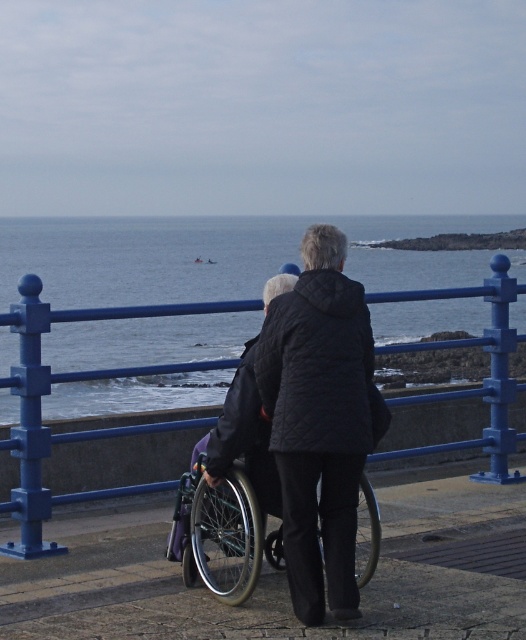
You are a photographer positioned at the edge of the promenade. You want to take a photo that includes both the black quilted jacket at center and the silver metallic wheelchair at center. Which object should you focus on first to ensure both are in sharp focus?

The black quilted jacket at center is closer to the viewer than the silver metallic wheelchair at center. To ensure both are in sharp focus, you should focus on the black quilted jacket at center first, as it is closer, and the depth of field will naturally include the farther object.

You are a visitor at the coast and want to take a photo of the blue water at center and the black quilted jacket at center. Which object should you focus on first if you want both to be in clear focus?

The blue water at center is further to the viewer than the black quilted jacket at center, so you should focus on the black quilted jacket at center first to ensure both are in clear focus.

Based on the scene description, where is the blue water at center located in terms of coordinates?

The blue water at center is located at coordinates point (x=222, y=256).